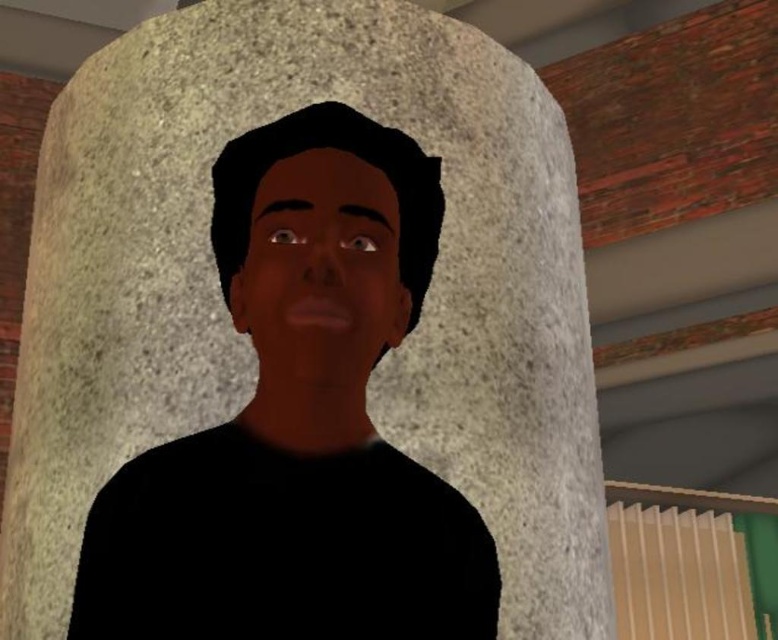
You are an interior designer assessing the layout of a room. You notice the smooth skin face at center and the beige plastic radiator at lower right. Which object takes up more visual space in the composition?

The beige plastic radiator at lower right takes up more visual space than the smooth skin face at center because the description states that the smooth skin face at center occupies less space than the beige plastic radiator at lower right.

You are an interior designer assessing the placement of objects in a room. You notice the matte black man at center and the smooth skin face at center. Which object would you need to adjust if you want both to be at the same height?

The matte black man at center is taller than the smooth skin face at center, so you would need to adjust the height of the smooth skin face at center to match the matte black man at center.